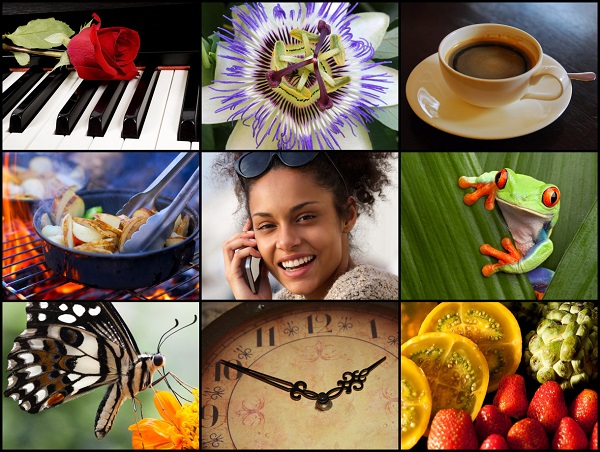
Identify the location of pictures in a collage. This screenshot has width=600, height=452. (485, 332), (303, 349), (72, 333), (79, 217), (281, 216), (506, 208), (507, 82), (286, 82), (123, 76).